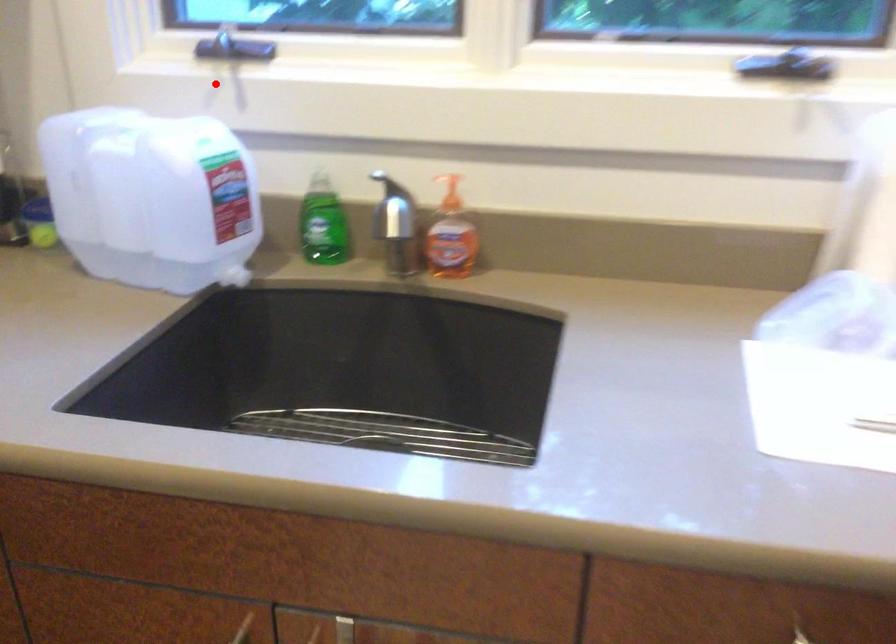
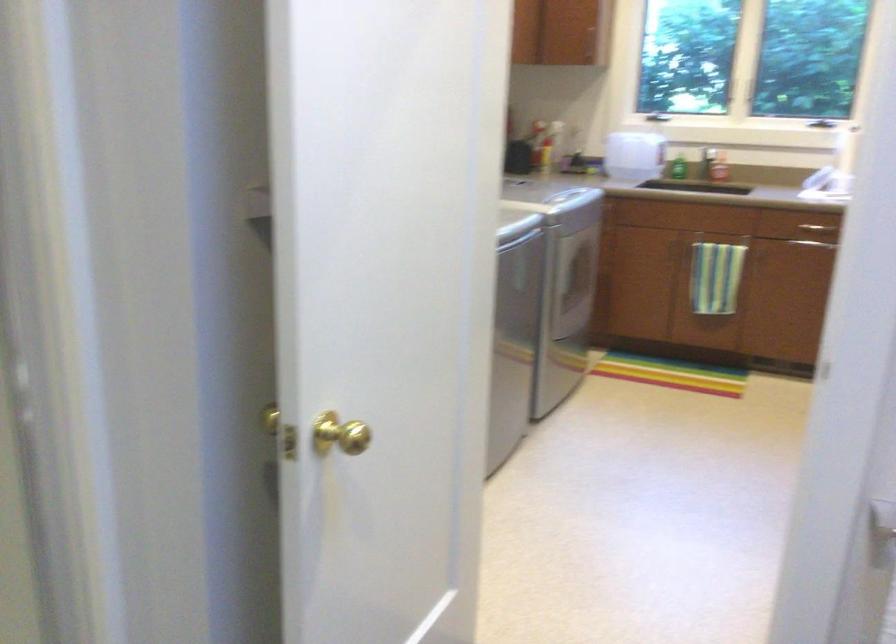
Where in the second image is the point corresponding to the highlighted location from the first image?

(655, 116)